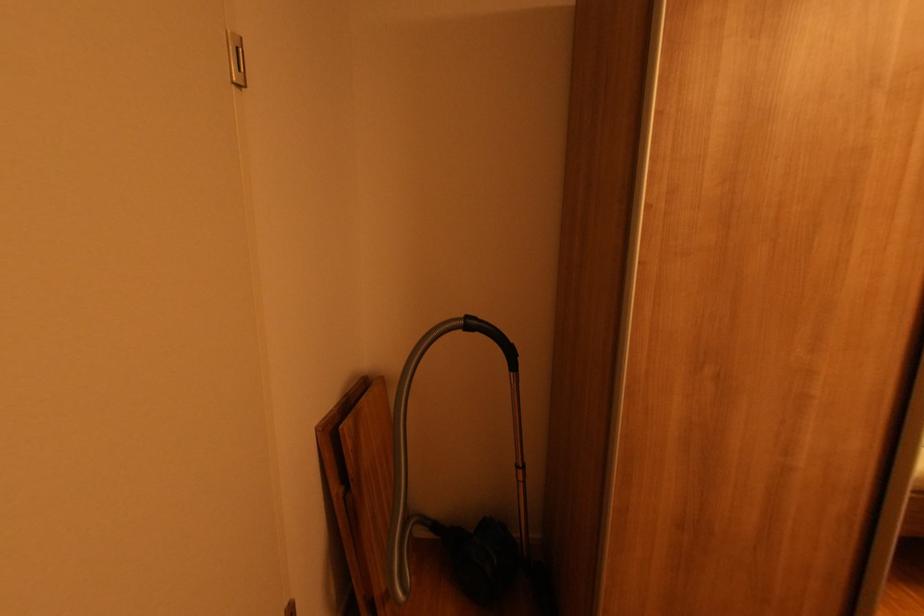
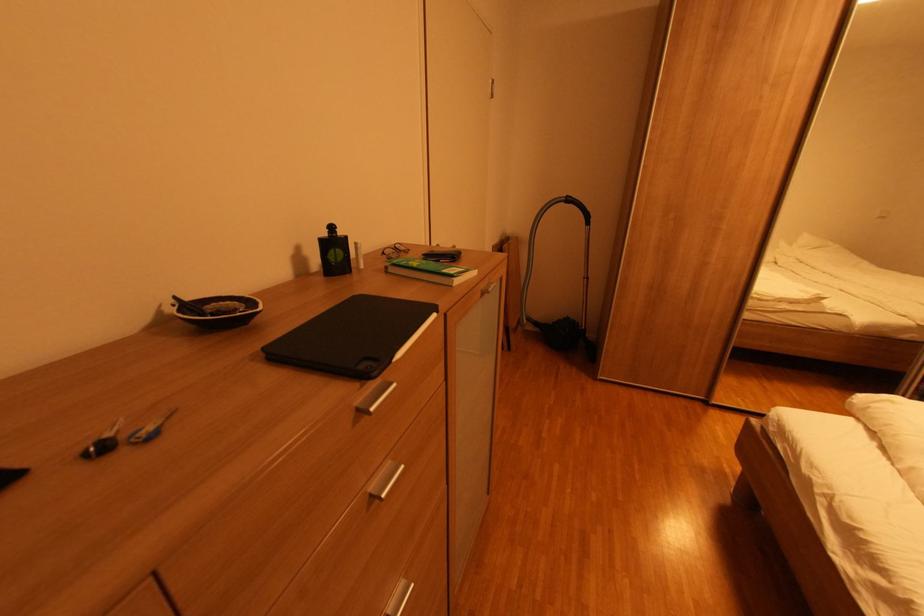
Where in the second image is the point corresponding to (467,333) from the first image?

(568, 205)